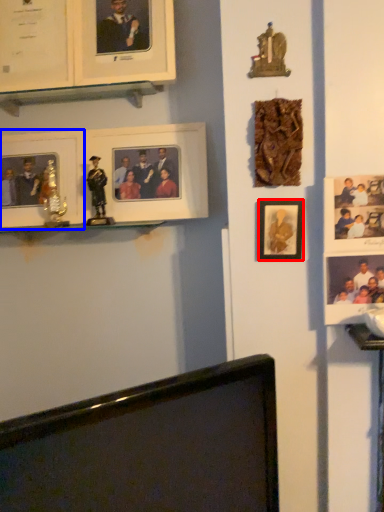
Question: Among these objects, which one is nearest to the camera, picture frame (highlighted by a red box) or picture frame (highlighted by a blue box)?

Choices:
 (A) picture frame
 (B) picture frame

Answer: (A)